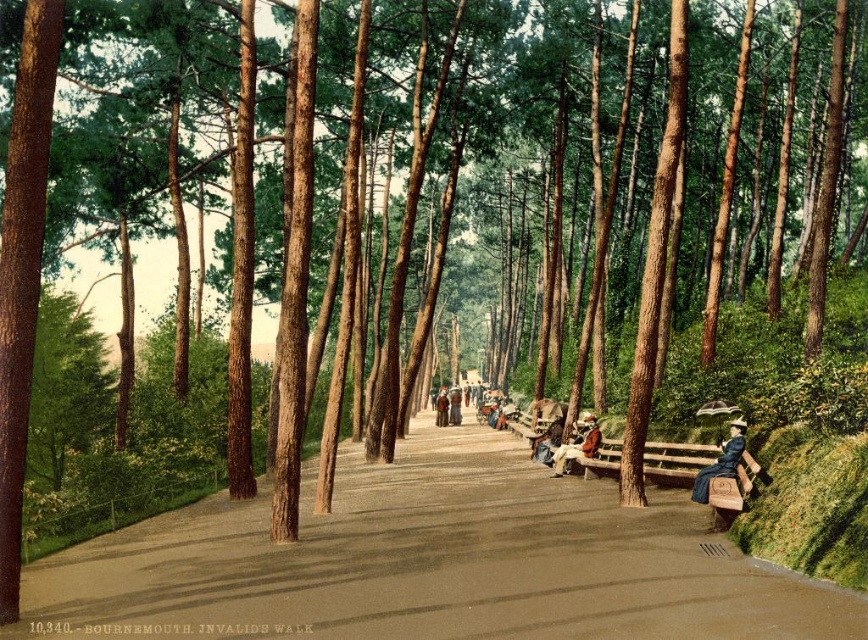
Is brown asphalt path at center closer to camera compared to denim jacket at center?

Yes, brown asphalt path at center is closer to the viewer.

Who is positioned more to the right, brown asphalt path at center or denim jacket at center?

denim jacket at center

Does point (437, 436) lie in front of point (551, 422)?

No, it is not.

The image size is (868, 640). I want to click on brown asphalt path at center, so click(x=431, y=563).

Who is positioned more to the left, wooden bench at center or brown leather jacket at center?

brown leather jacket at center

The image size is (868, 640). I want to click on wooden bench at center, so click(577, 444).

Between point (590, 456) and point (446, 422), which one is positioned in front?

Point (590, 456) is more forward.

Where is `wooden bench at center`? wooden bench at center is located at coordinates (577, 444).

Between wooden bench at center and denim jacket at center, which one appears on the right side from the viewer's perspective?

wooden bench at center is more to the right.

Does point (579, 456) come behind point (548, 436)?

No, (579, 456) is in front of (548, 436).

You are a GUI agent. You are given a task and a screenshot of the screen. Output one action in this format:
    pyautogui.click(x=<x>, y=<y>)
    Task: Click on the wooden bench at center
    This screenshot has height=640, width=868.
    Given the screenshot: What is the action you would take?
    pyautogui.click(x=577, y=444)